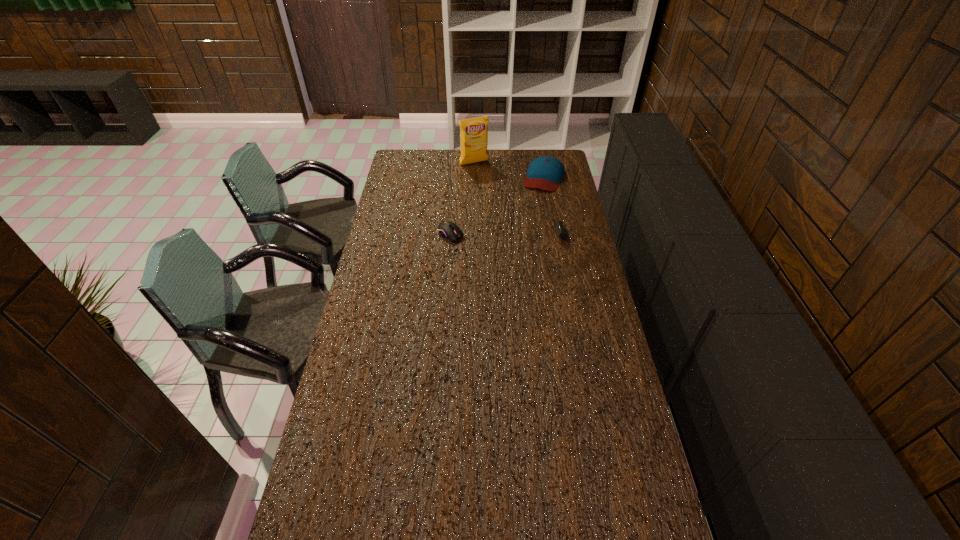
I want to click on computer mouse, so click(x=446, y=229).

Find the location of a particular element. webcam is located at coordinates pos(561,231).

You are a GUI agent. You are given a task and a screenshot of the screen. Output one action in this format:
    pyautogui.click(x=<x>, y=<y>)
    Task: Click on the crisp (potato chip)
    
    Given the screenshot: What is the action you would take?
    pyautogui.click(x=473, y=132)

Where is `the second tallest object`? the second tallest object is located at coordinates (545, 172).

Locate an element on the screen. Image resolution: width=960 pixels, height=540 pixels. blank area located 0.260m on the front of the computer mouse is located at coordinates (446, 287).

Identify the location of free region located on the front-facing side of the webcam. This screenshot has width=960, height=540. (468, 234).

Locate an element on the screen. The width and height of the screenshot is (960, 540). blank space located on the front-facing side of the webcam is located at coordinates (471, 234).

At what (x,y) coordinates should I click in order to perform the action: click on vacant area located 0.390m on the front-facing side of the webcam. Please return your answer as a coordinate pair (x, y). This screenshot has height=540, width=960. Looking at the image, I should click on (467, 234).

I want to click on vacant region located 0.210m on the front of the tallest object with the logo, so click(x=493, y=188).

The height and width of the screenshot is (540, 960). In order to click on free space located on the front of the tallest object with the logo in this screenshot , I will do `click(507, 207)`.